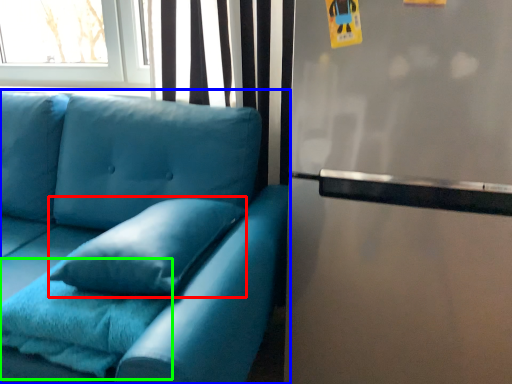
Question: Which object is the closest to the pillow (highlighted by a red box)? Choose among these: studio couch (highlighted by a blue box) or blanket (highlighted by a green box).

Choices:
 (A) studio couch
 (B) blanket

Answer: (B)